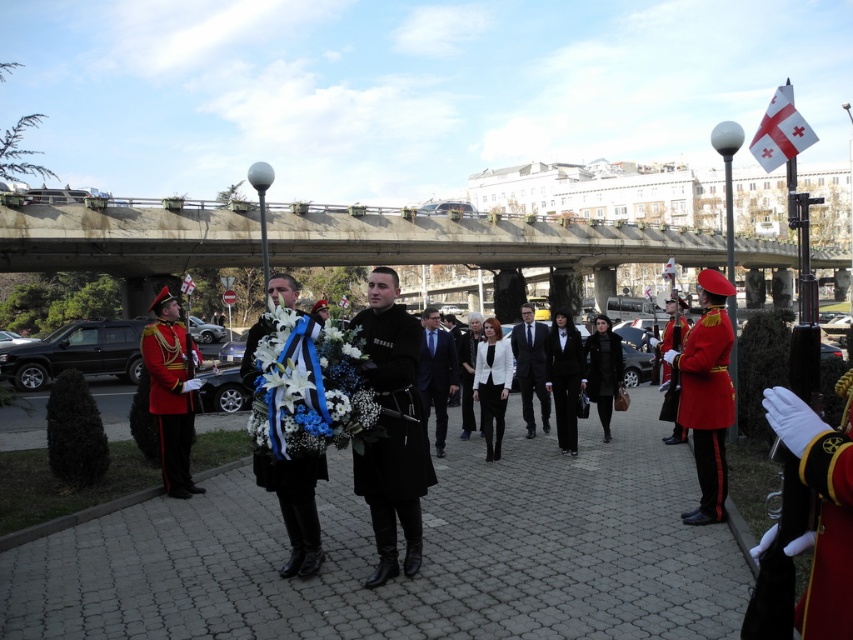
Question: Does black matte coat at center have a lesser width compared to shiny red uniform at left?

Choices:
 (A) no
 (B) yes

Answer: (A)

Question: Among these points, which one is nearest to the camera?

Choices:
 (A) (314, 472)
 (B) (425, 372)

Answer: (A)

Question: Considering the relative positions of white floral wreath at center and black wool coat at center in the image provided, where is white floral wreath at center located with respect to black wool coat at center?

Choices:
 (A) right
 (B) left

Answer: (B)

Question: Which of the following is the closest to the observer?

Choices:
 (A) (572, 433)
 (B) (378, 326)
 (C) (426, 397)
 (D) (471, 381)

Answer: (B)

Question: Can you confirm if dark suit at center is positioned to the left of shiny red uniform at right?

Choices:
 (A) yes
 (B) no

Answer: (A)

Question: Which of the following is the closest to the observer?

Choices:
 (A) (467, 433)
 (B) (664, 346)

Answer: (A)